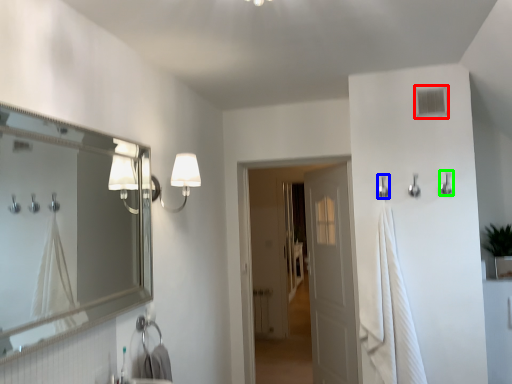
Question: Which object is positioned closest to window (highlighted by a red box)? Select from shower (highlighted by a blue box) and shower (highlighted by a green box).

Choices:
 (A) shower
 (B) shower

Answer: (B)